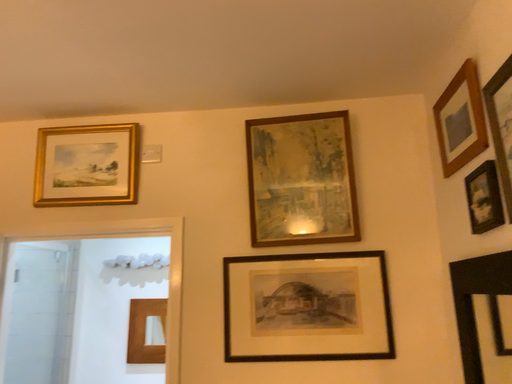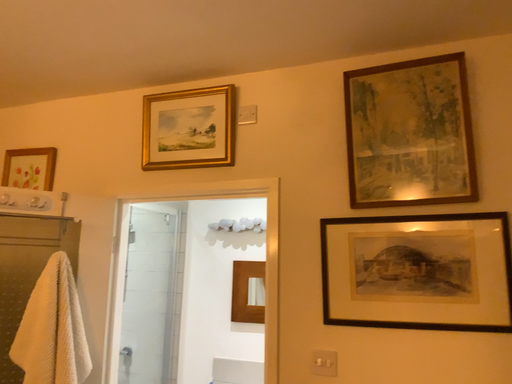
Question: Which way did the camera rotate in the video?

Choices:
 (A) rotated left
 (B) rotated right

Answer: (A)